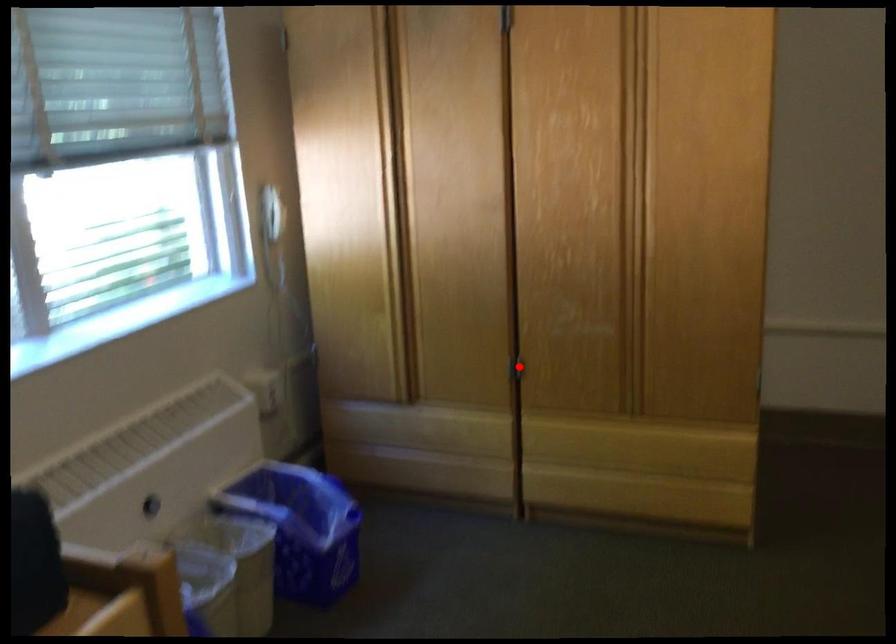
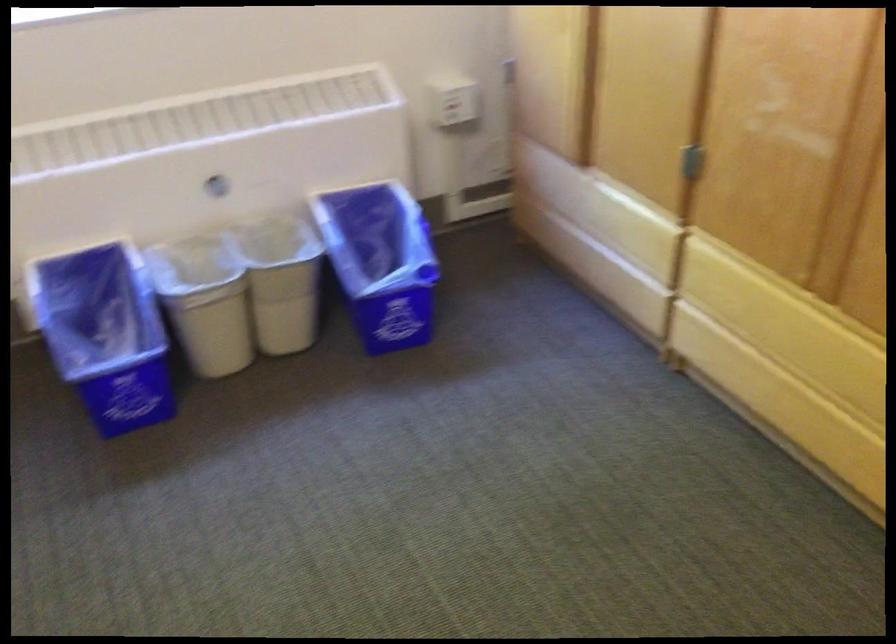
Question: I am providing you with two images of the same scene from different viewpoints. A red point is shown in image1. For the corresponding object point in image2, is it positioned nearer or farther from the camera?

Choices:
 (A) Nearer
 (B) Farther

Answer: (A)